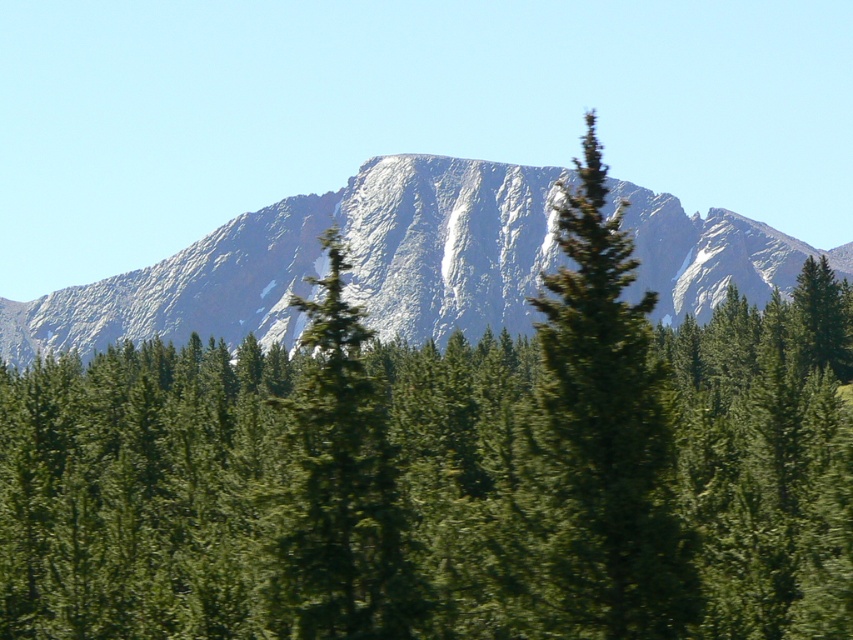
Is gray rocky mountain at center taller than green textured tree at center?

Incorrect, gray rocky mountain at center's height is not larger of green textured tree at center's.

What do you see at coordinates (323, 262) in the screenshot? I see `gray rocky mountain at center` at bounding box center [323, 262].

What do you see at coordinates (323, 262) in the screenshot?
I see `gray rocky mountain at center` at bounding box center [323, 262].

You are a GUI agent. You are given a task and a screenshot of the screen. Output one action in this format:
    pyautogui.click(x=<x>, y=<y>)
    Task: Click on the gray rocky mountain at center
    Image resolution: width=853 pixels, height=640 pixels.
    Given the screenshot: What is the action you would take?
    pyautogui.click(x=323, y=262)

Can you confirm if green leafy trees at center is positioned below green textured tree at center?

Indeed, green leafy trees at center is positioned under green textured tree at center.

Which is behind, point (508, 474) or point (608, 572)?

Point (508, 474)

The image size is (853, 640). In order to click on green leafy trees at center in this screenshot , I will do `click(141, 490)`.

Who is taller, green leafy trees at center or gray rocky mountain at center?

gray rocky mountain at center is taller.

Who is more forward, (96, 432) or (80, 300)?

Point (96, 432) is in front.

This screenshot has height=640, width=853. Find the location of `green leafy trees at center`. green leafy trees at center is located at coordinates (141, 490).